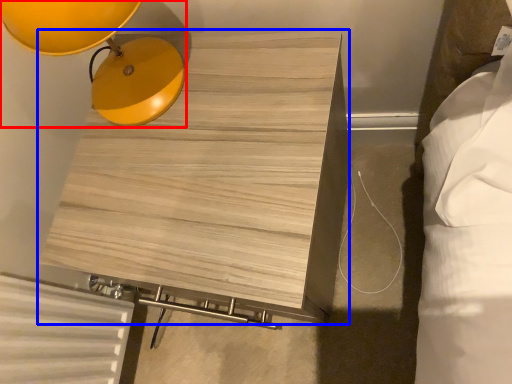
Question: Which object is further to the camera taking this photo, lamp (highlighted by a red box) or furniture (highlighted by a blue box)?

Choices:
 (A) lamp
 (B) furniture

Answer: (B)